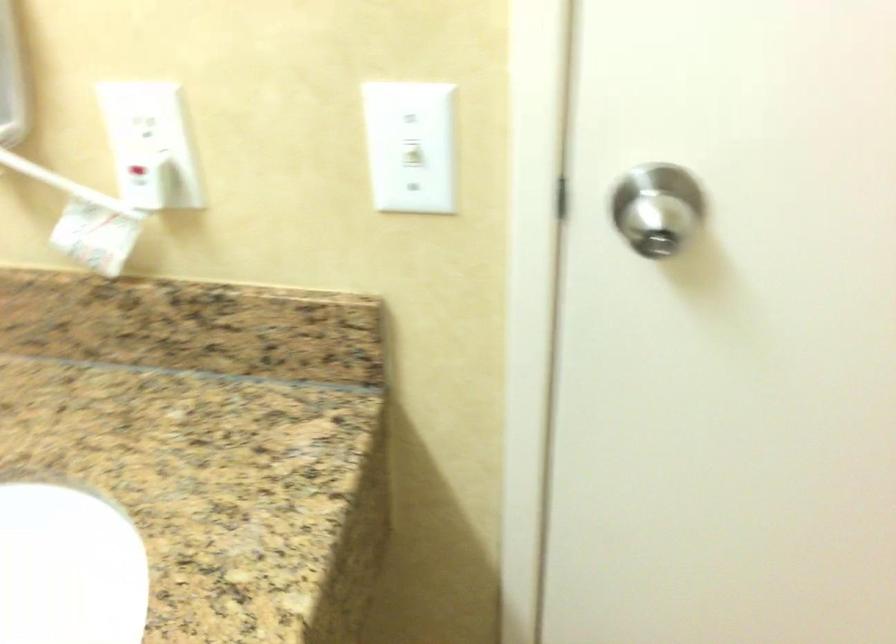
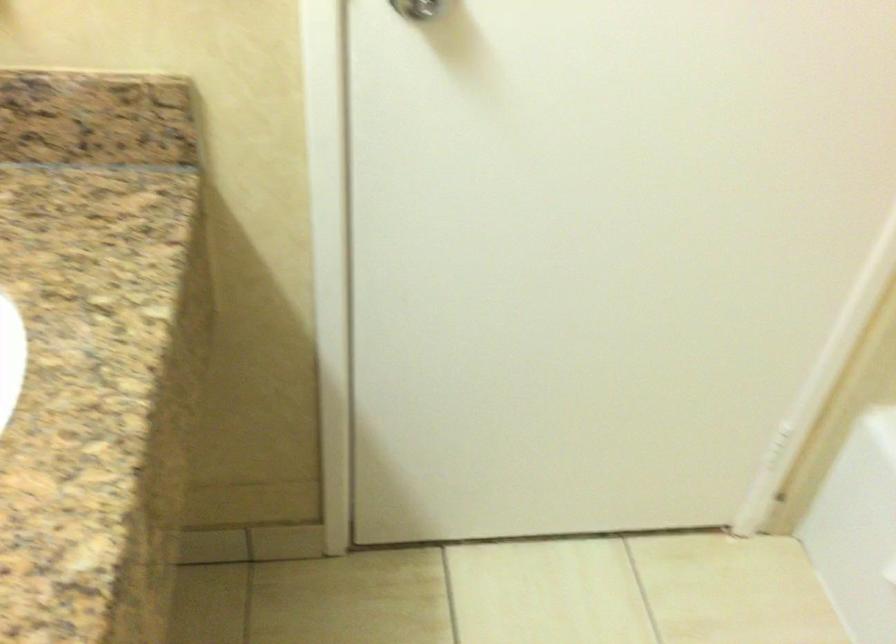
Find the pixel in the second image that matches pixel 645 237 in the first image.

(417, 8)